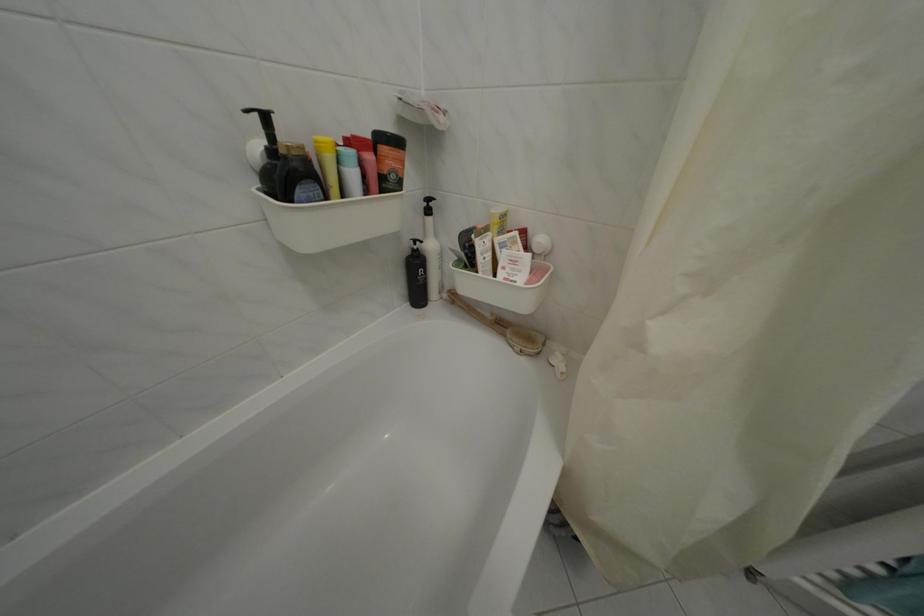
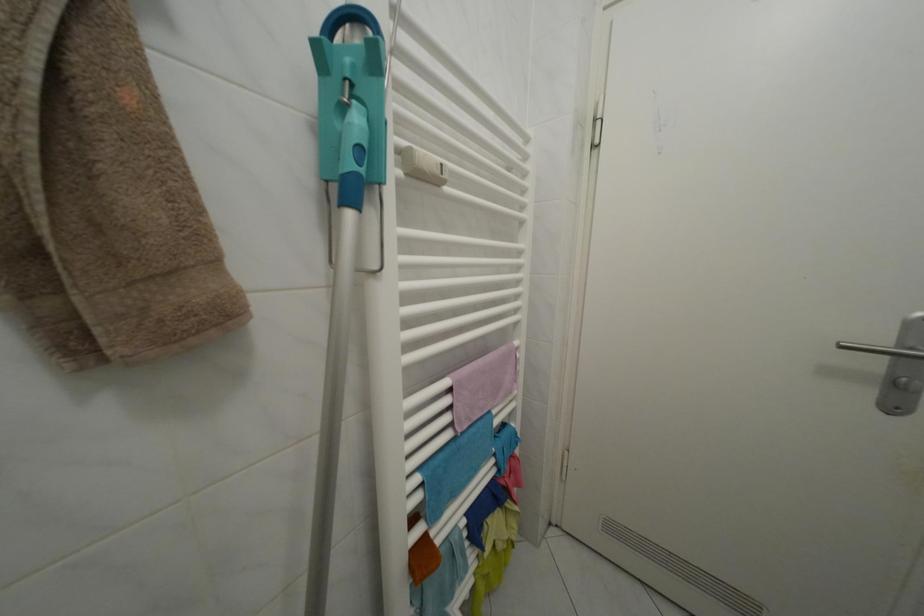
Question: Based on the continuous images, in which direction is the camera rotating? Reply with the corresponding letter.

Choices:
 (A) Left
 (B) Right
 (C) Up
 (D) Down

Answer: (B)